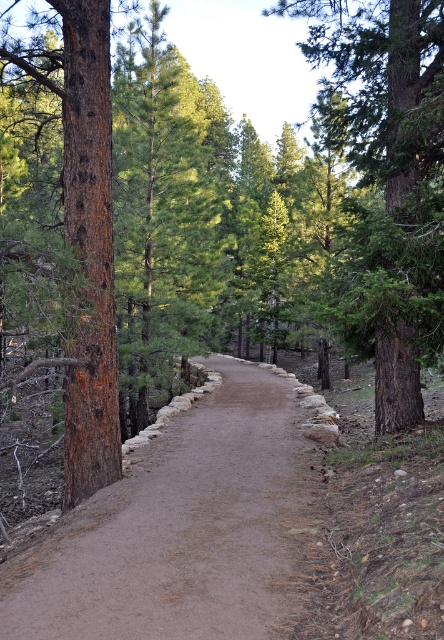
You are a hiker standing on the dirt path at center. You want to know if you can see the top of the green rough bark tree at center from your current position. Can you?

The dirt path at center has a lesser height compared to green rough bark tree at center, so yes, you can see the top of the green rough bark tree at center from your current position because the tree is taller than the path.

You are standing on the dirt path at center and want to touch the green rough bark tree at center. Which direction should you move to get closer to the tree?

The dirt path at center is closer to the viewer than the green rough bark tree at center, so to reach the tree, you should move forward along the path towards it.